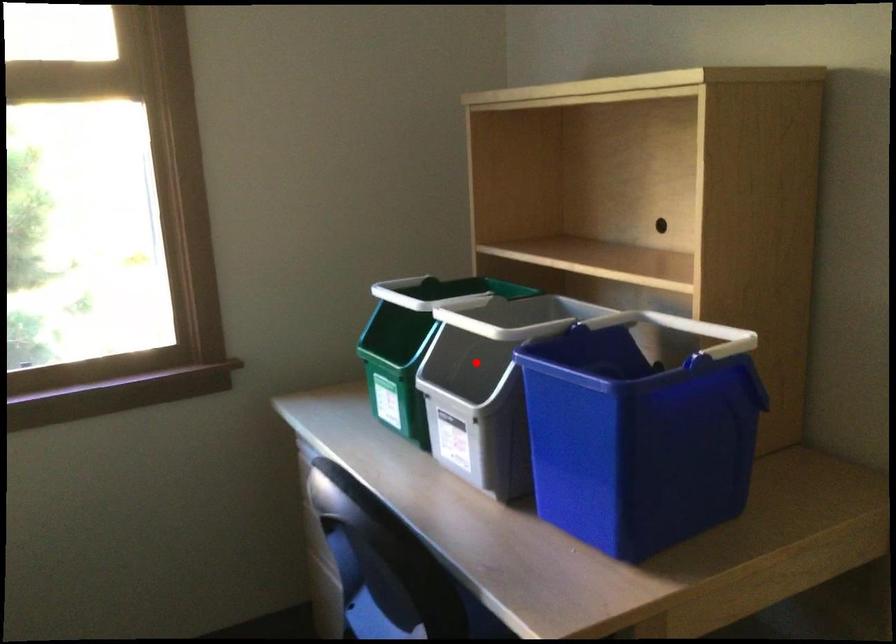
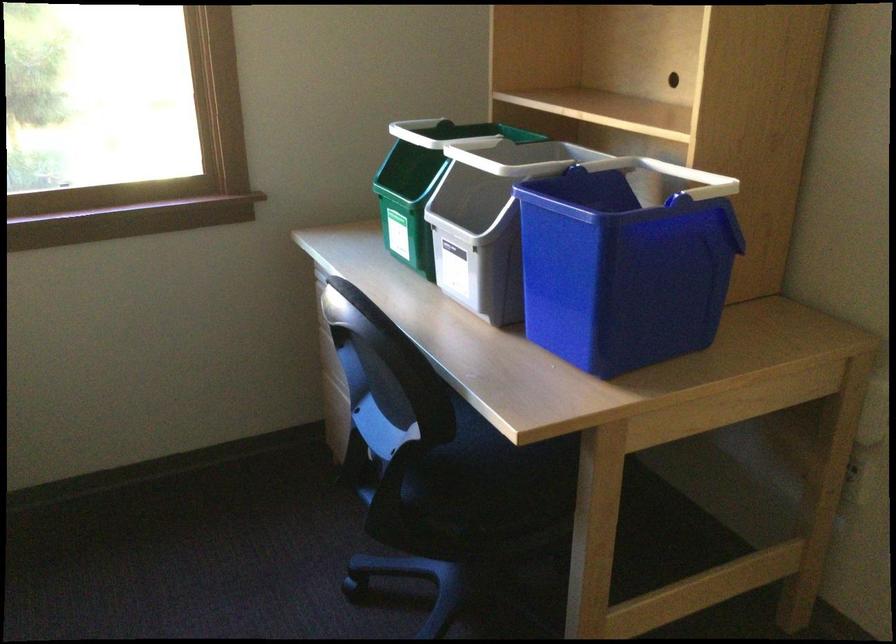
Locate, in the second image, the point that corresponds to the highlighted location in the first image.

(479, 201)